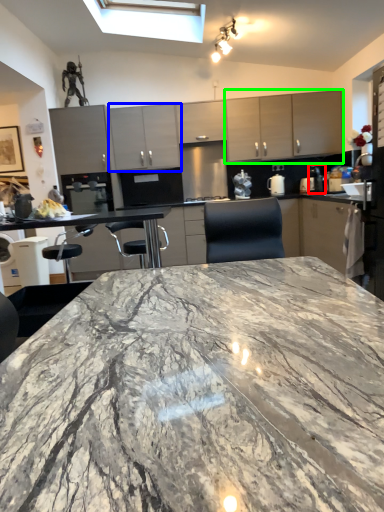
Question: Considering the real-world distances, which object is closest to coffee machine (highlighted by a red box)? cabinetry (highlighted by a blue box) or cabinetry (highlighted by a green box).

Choices:
 (A) cabinetry
 (B) cabinetry

Answer: (B)